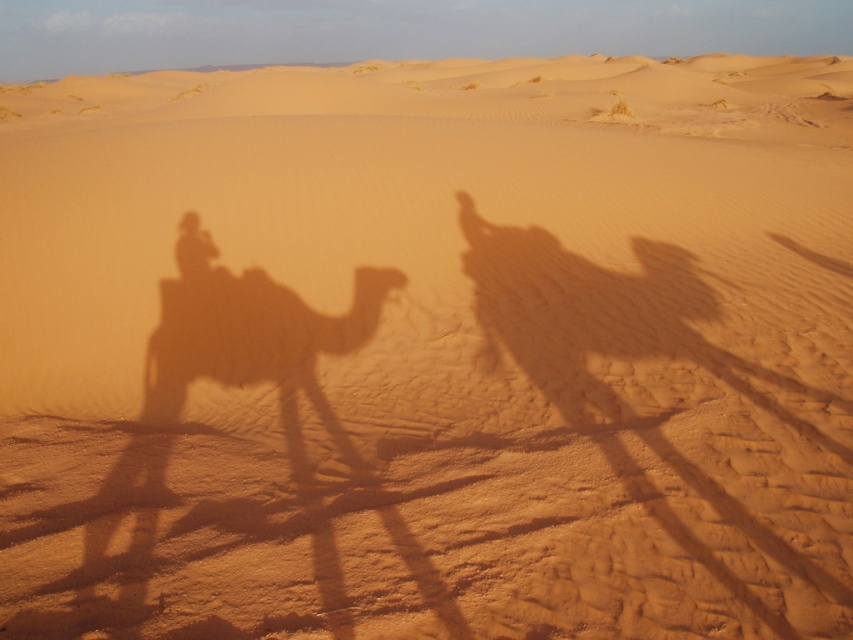
Which is more to the right, brown textured camel at left or smooth sand camel at center?

From the viewer's perspective, brown textured camel at left appears more on the right side.

Locate an element on the screen. brown textured camel at left is located at coordinates (256, 344).

The height and width of the screenshot is (640, 853). What do you see at coordinates (256, 344) in the screenshot?
I see `brown textured camel at left` at bounding box center [256, 344].

Image resolution: width=853 pixels, height=640 pixels. Find the location of `brown textured camel at left`. brown textured camel at left is located at coordinates (256, 344).